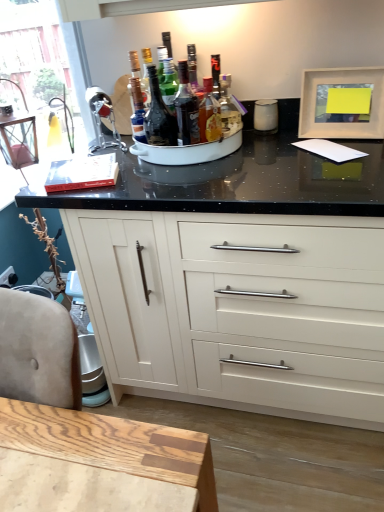
Question: Considering their positions, is translucent glass bottle at center, which is the 1th bottle in left-to-right order, located in front of or behind translucent glass bottle at center, the 3th bottle in the left-to-right sequence?

Choices:
 (A) behind
 (B) front

Answer: (B)

Question: From the image's perspective, is translucent glass bottle at center, which is the 3th bottle from right to left, positioned above or below translucent glass bottle at center, marked as the first bottle in a right-to-left arrangement?

Choices:
 (A) below
 (B) above

Answer: (B)

Question: Which of these objects is positioned closest to the matte white picture frame at upper right?

Choices:
 (A) white matte cabinet at center
 (B) translucent glass bottle at center, marked as the first bottle in a right-to-left arrangement
 (C) translucent glass bottle at center, which is the 1th bottle in left-to-right order
 (D) shiny dark glass bottle at center, the second bottle positioned from the right

Answer: (B)

Question: Estimate the real-world distances between objects in this image. Which object is closer to the translucent glass bottle at center, marked as the first bottle in a right-to-left arrangement?

Choices:
 (A) translucent glass bottle at center, which is the 1th bottle in left-to-right order
 (B) white matte cabinet at center
 (C) matte white picture frame at upper right
 (D) shiny dark glass bottle at center, the second bottle positioned from the right

Answer: (D)